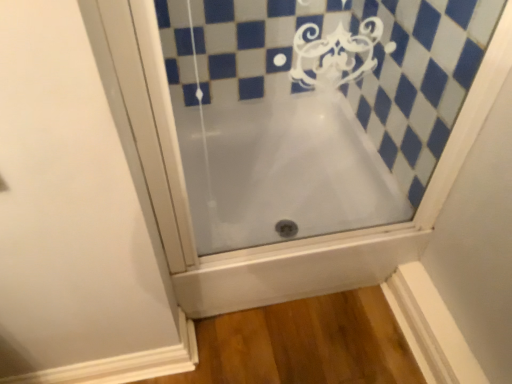
Question: In terms of size, does white glossy bathtub at center appear bigger or smaller than white frosted glass bathtub at center?

Choices:
 (A) big
 (B) small

Answer: (A)

Question: Is white glossy bathtub at center inside or outside of white frosted glass bathtub at center?

Choices:
 (A) inside
 (B) outside

Answer: (B)

Question: From their relative heights in the image, would you say white glossy bathtub at center is taller or shorter than white frosted glass bathtub at center?

Choices:
 (A) tall
 (B) short

Answer: (B)

Question: Looking at the image, does white frosted glass bathtub at center seem bigger or smaller compared to white glossy bathtub at center?

Choices:
 (A) small
 (B) big

Answer: (A)

Question: Relative to white glossy bathtub at center, is white frosted glass bathtub at center in front or behind?

Choices:
 (A) behind
 (B) front

Answer: (B)

Question: Is white frosted glass bathtub at center to the left or to the right of white glossy bathtub at center in the image?

Choices:
 (A) left
 (B) right

Answer: (B)

Question: In terms of width, does white frosted glass bathtub at center look wider or thinner when compared to white glossy bathtub at center?

Choices:
 (A) thin
 (B) wide

Answer: (A)